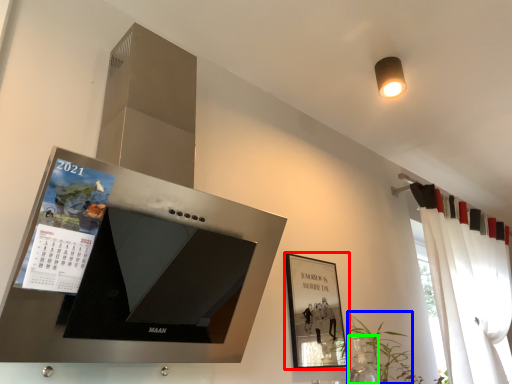
Question: Which object is the closest to the picture frame (highlighted by a red box)? Choose among these: plant (highlighted by a blue box) or glass vase (highlighted by a green box).

Choices:
 (A) plant
 (B) glass vase

Answer: (B)